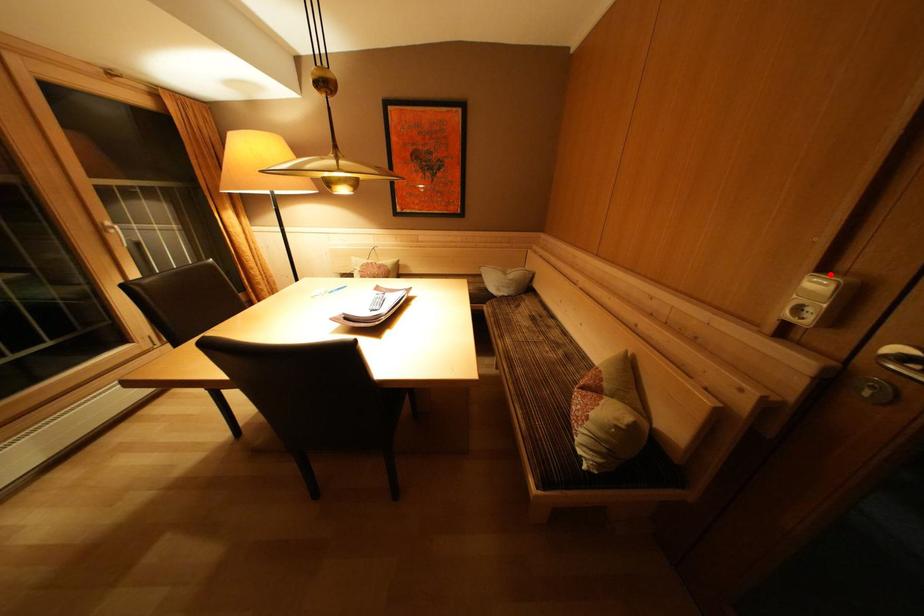
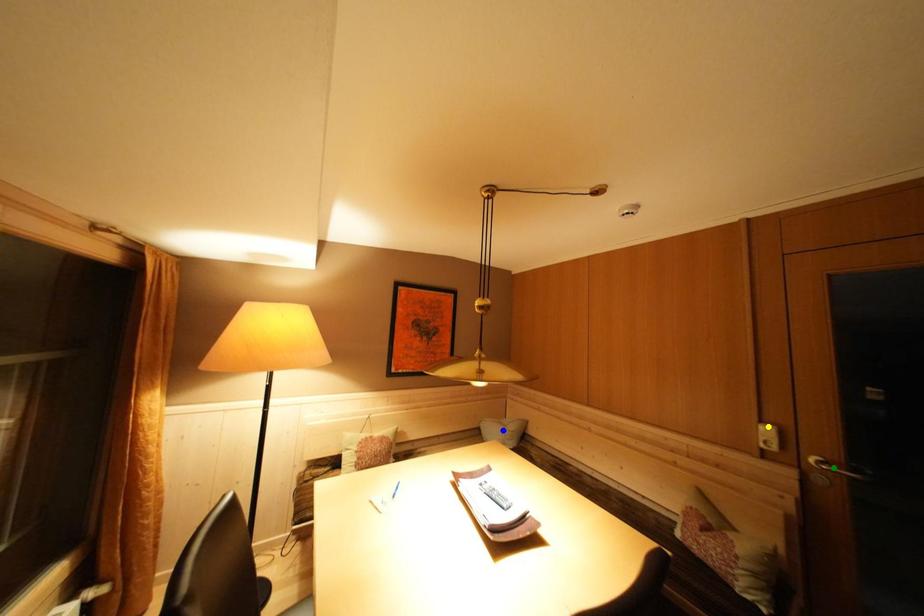
Question: I am providing you with two images of the same scene from different viewpoints. A red point is marked on the first image. You are given multiple points on the second image. Which point in image 2 represents the same 3d spot as the red point in image 1?

Choices:
 (A) yellow point
 (B) green point
 (C) blue point

Answer: (A)